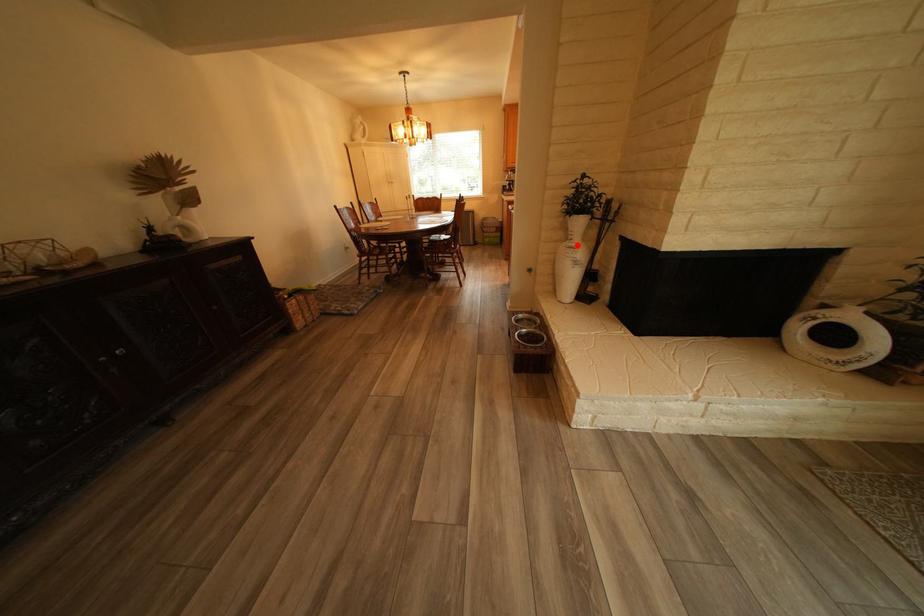
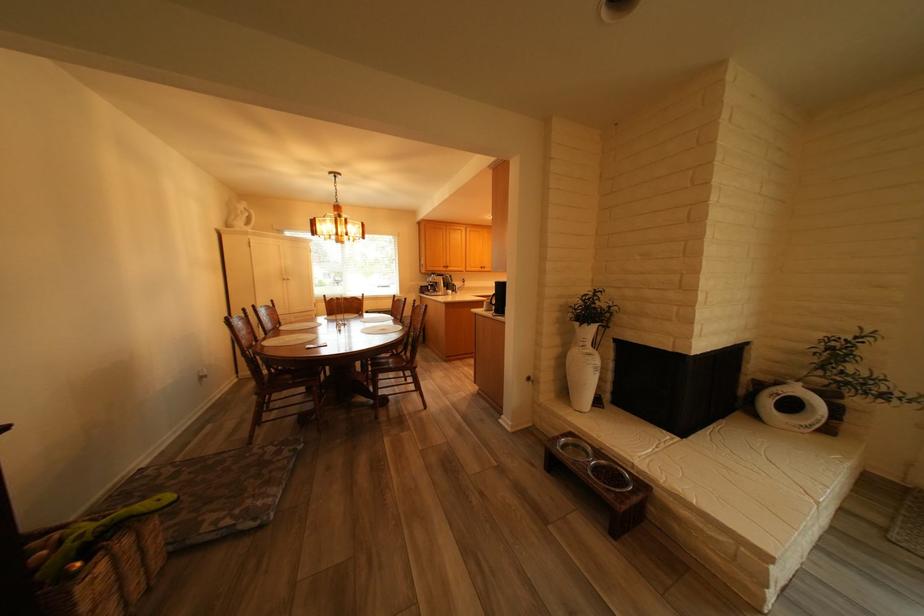
In the second image, find the point that corresponds to the highlighted location in the first image.

(590, 352)